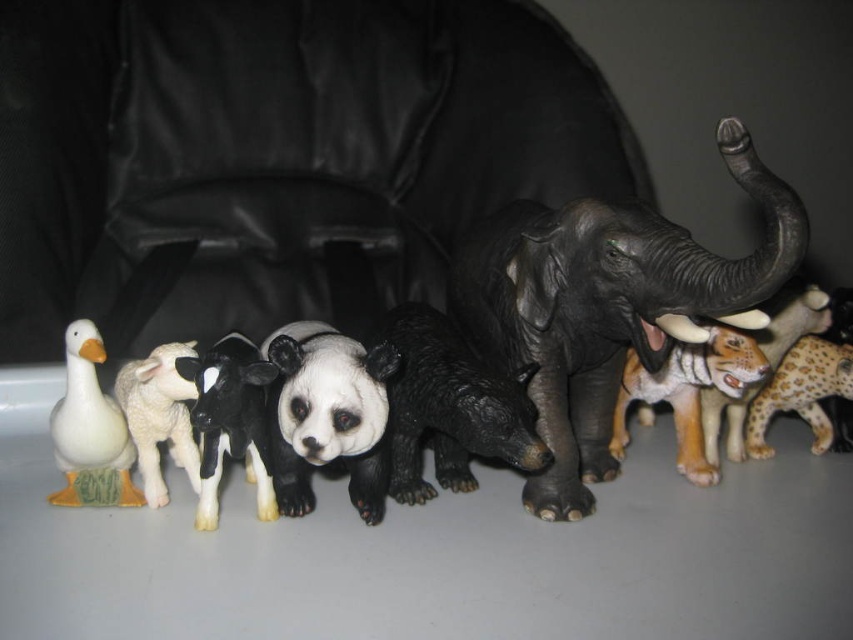
Who is higher up, black matte/painted panda at center or orange-brown plastic tiger at center-right?

black matte/painted panda at center is higher up.

Image resolution: width=853 pixels, height=640 pixels. In order to click on black matte/painted panda at center in this screenshot , I will do `click(328, 413)`.

The image size is (853, 640). Describe the element at coordinates (328, 413) in the screenshot. I see `black matte/painted panda at center` at that location.

Locate an element on the screen. black matte/painted panda at center is located at coordinates (328, 413).

From the picture: Who is shorter, black matte/painted panda at center or spotted fur leopard at right?

spotted fur leopard at right is shorter.

Can you confirm if black matte/painted panda at center is taller than spotted fur leopard at right?

Indeed, black matte/painted panda at center has a greater height compared to spotted fur leopard at right.

You are a GUI agent. You are given a task and a screenshot of the screen. Output one action in this format:
    pyautogui.click(x=<x>, y=<y>)
    Task: Click on the black matte/painted panda at center
    This screenshot has width=853, height=640.
    Given the screenshot: What is the action you would take?
    pyautogui.click(x=328, y=413)

Which is in front, point (242, 404) or point (86, 488)?

Positioned in front is point (242, 404).

Locate an element on the screen. The width and height of the screenshot is (853, 640). black matte panda at center is located at coordinates (230, 419).